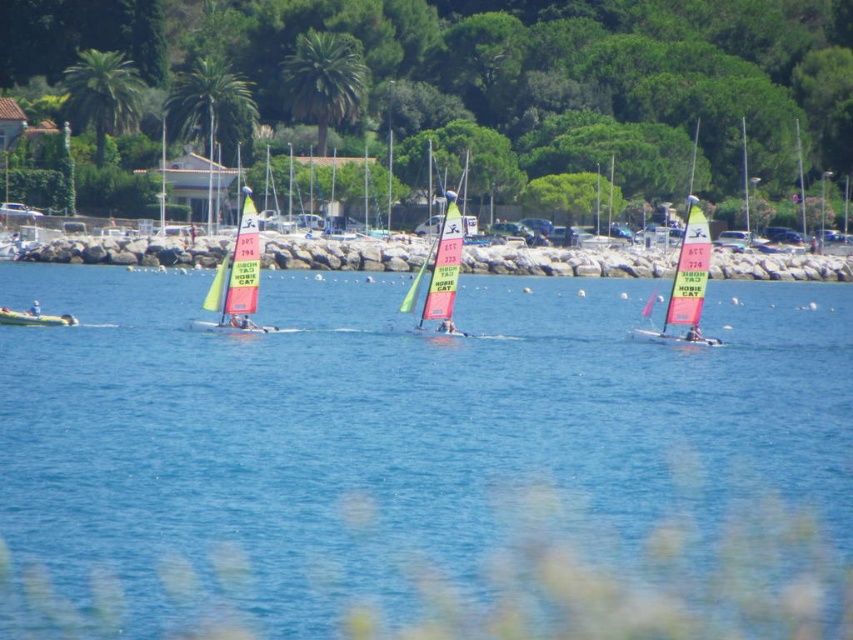
Which is more to the left, yellow-green sailboat at center-left or white plastic kayak at left?

From the viewer's perspective, white plastic kayak at left appears more on the left side.

The height and width of the screenshot is (640, 853). Find the location of `yellow-green sailboat at center-left`. yellow-green sailboat at center-left is located at coordinates (236, 280).

Identify the location of yellow-green sailboat at center-left. The image size is (853, 640). coord(236,280).

Does blue water at center appear on the right side of yellow-green sailboat at center-left?

Correct, you'll find blue water at center to the right of yellow-green sailboat at center-left.

Can you confirm if blue water at center is shorter than yellow-green sailboat at center-left?

Incorrect, blue water at center's height does not fall short of yellow-green sailboat at center-left's.

What do you see at coordinates (384, 413) in the screenshot? This screenshot has width=853, height=640. I see `blue water at center` at bounding box center [384, 413].

The height and width of the screenshot is (640, 853). Find the location of `blue water at center`. blue water at center is located at coordinates (384, 413).

Which is in front, point (670, 291) or point (4, 323)?

Point (4, 323)

Does pink fabric sailboat at right appear on the left side of yellow matte kayak at left?

No, pink fabric sailboat at right is not to the left of yellow matte kayak at left.

The image size is (853, 640). I want to click on pink fabric sailboat at right, so click(686, 284).